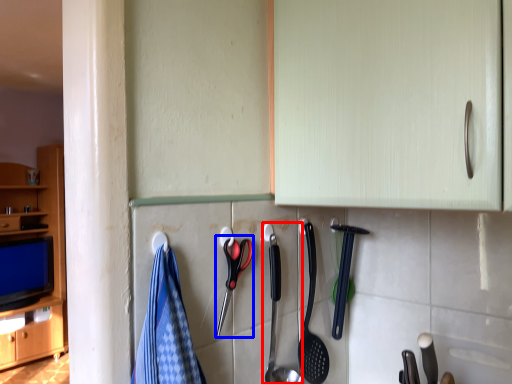
Question: Which object appears closest to the camera in this image, silverware (highlighted by a red box) or scissors (highlighted by a blue box)?

Choices:
 (A) silverware
 (B) scissors

Answer: (B)